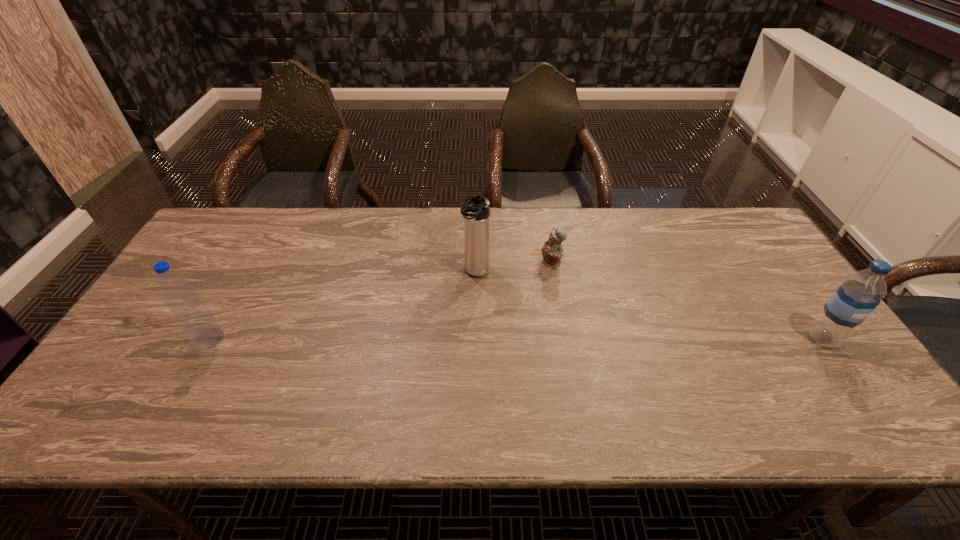
Locate an element on the screen. The width and height of the screenshot is (960, 540). the left water bottle is located at coordinates (191, 313).

Find the location of `the right water bottle`. the right water bottle is located at coordinates (861, 292).

The width and height of the screenshot is (960, 540). I want to click on the third object from left to right, so click(x=552, y=251).

Locate an element on the screen. This screenshot has height=540, width=960. teddy bear is located at coordinates (552, 251).

The image size is (960, 540). I want to click on thermos bottle, so click(x=476, y=212).

Where is `free location located 0.200m on the back of the leftmost object`? This screenshot has width=960, height=540. free location located 0.200m on the back of the leftmost object is located at coordinates (244, 275).

At what (x,y) coordinates should I click in order to perform the action: click on vacant space situated 0.130m on the label of the rightmost object. Please return your answer as a coordinate pair (x, y). Looking at the image, I should click on (864, 397).

This screenshot has width=960, height=540. I want to click on vacant space located on the front-facing side of the teddy bear, so click(446, 342).

Locate an element on the screen. The image size is (960, 540). vacant space located 0.280m on the front-facing side of the teddy bear is located at coordinates (477, 319).

Locate an element on the screen. The width and height of the screenshot is (960, 540). free spot located 0.220m on the front-facing side of the teddy bear is located at coordinates (493, 307).